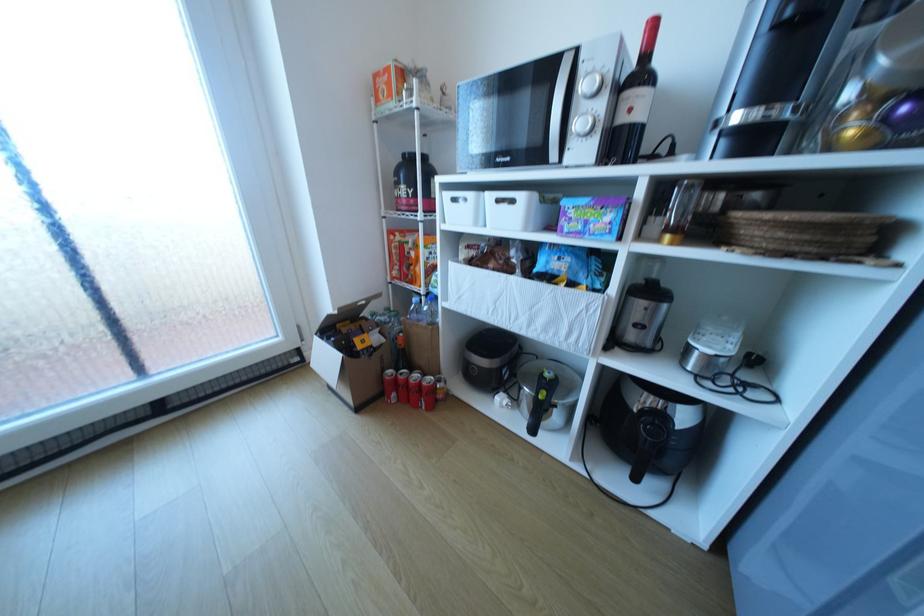
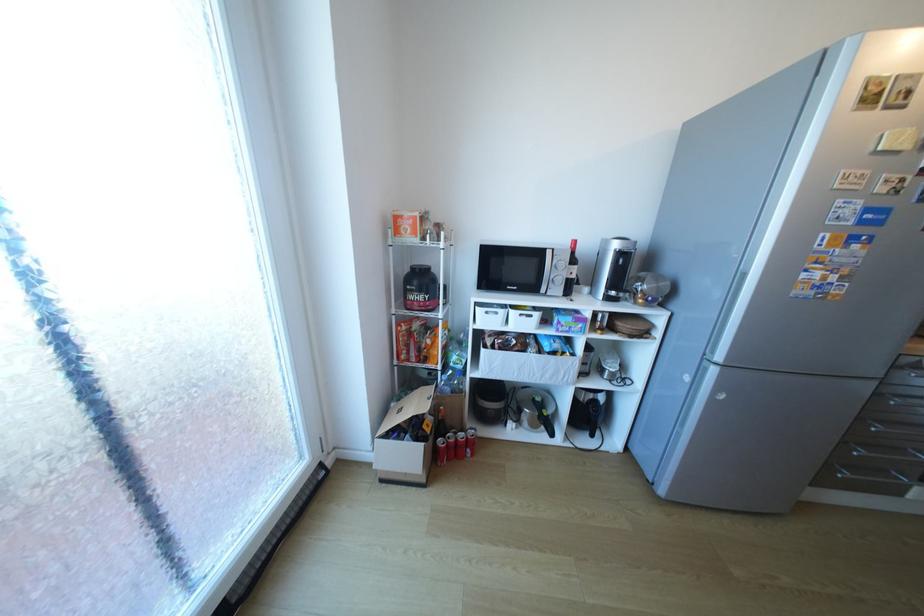
The point at (521, 201) is marked in the first image. Where is the corresponding point in the second image?

(540, 315)